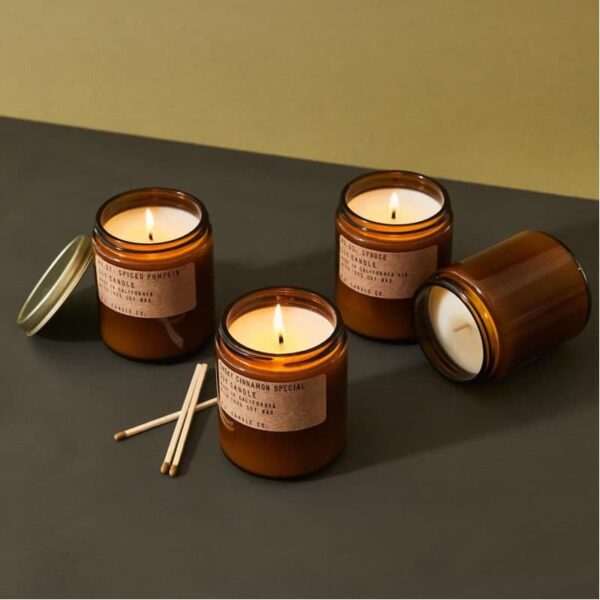
At what (x,y) coordinates should I click in order to perform the action: click on 3 candle labels. Please return your answer as a coordinate pair (x, y). The image size is (600, 600). Looking at the image, I should click on (144, 299), (240, 394), (376, 271).